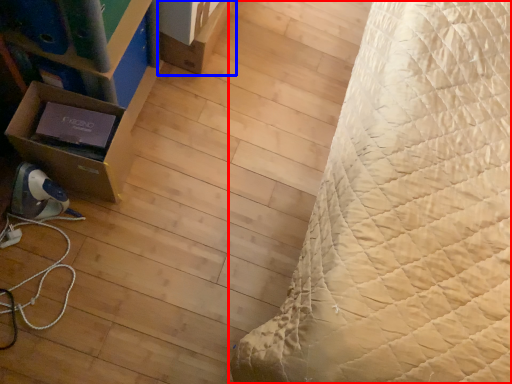
Question: Which of the following is the farthest to the observer, bed (highlighted by a red box) or cardboard box (highlighted by a blue box)?

Choices:
 (A) bed
 (B) cardboard box

Answer: (B)